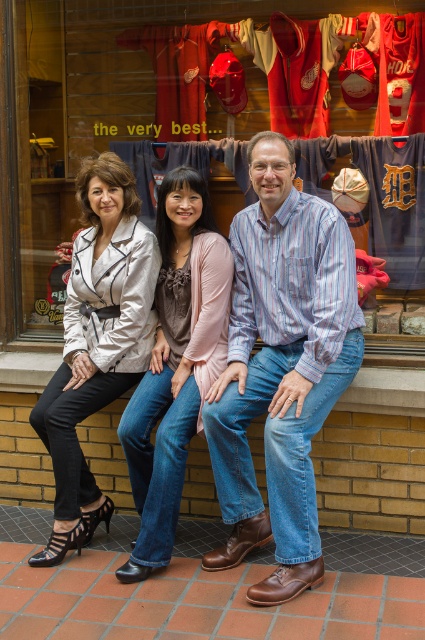
Does blue striped shirt at center appear under denim jeans at center?

Incorrect, blue striped shirt at center is not positioned below denim jeans at center.

Can you confirm if blue striped shirt at center is taller than denim jeans at center?

Yes.

The image size is (425, 640). Identify the location of blue striped shirt at center. (280, 368).

This screenshot has width=425, height=640. In order to click on blue striped shirt at center in this screenshot , I will do `click(280, 368)`.

Who is higher up, matte black jacket at center or denim jeans at center?

matte black jacket at center is above.

Between point (280, 211) and point (201, 266), which one is positioned in front?

Point (280, 211) is in front.

What are the coordinates of `matte black jacket at center` in the screenshot? It's located at (280, 368).

Is matte jersey at center in front of blue striped shirt at center?

No, matte jersey at center is behind blue striped shirt at center.

Image resolution: width=425 pixels, height=640 pixels. Find the location of `matte jersey at center`. matte jersey at center is located at coordinates (107, 109).